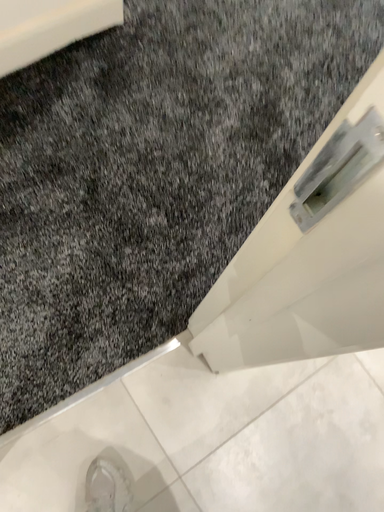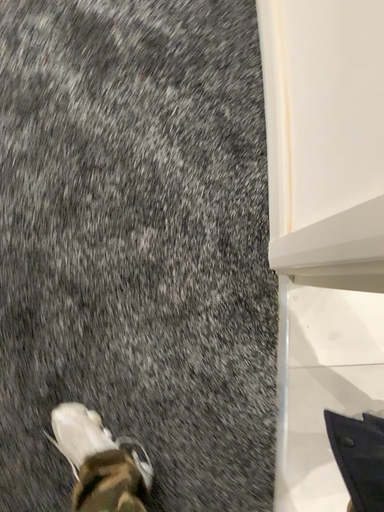
Question: Which way did the camera rotate in the video?

Choices:
 (A) rotated upward
 (B) rotated downward

Answer: (B)